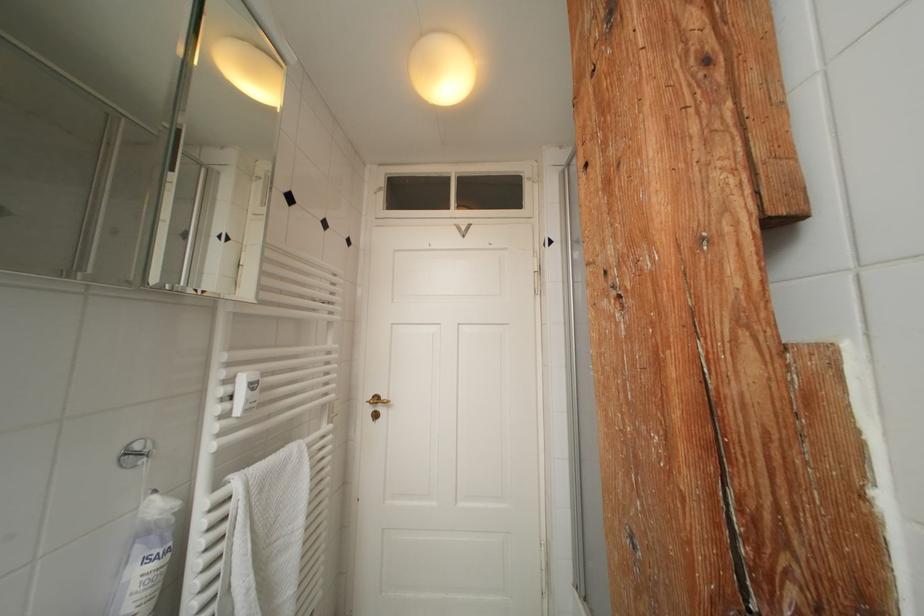
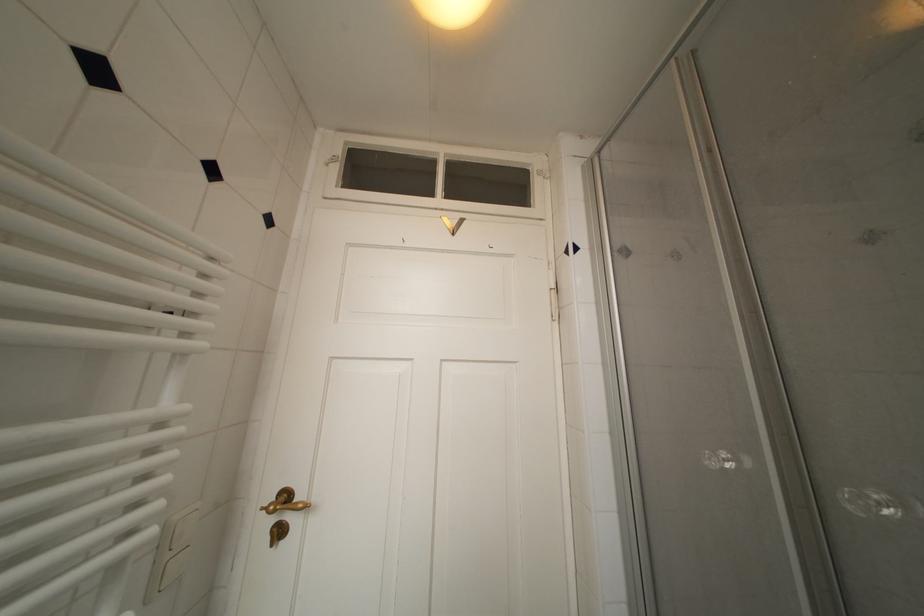
Locate, in the second image, the point that corresponds to point 383,402 in the first image.

(293, 500)